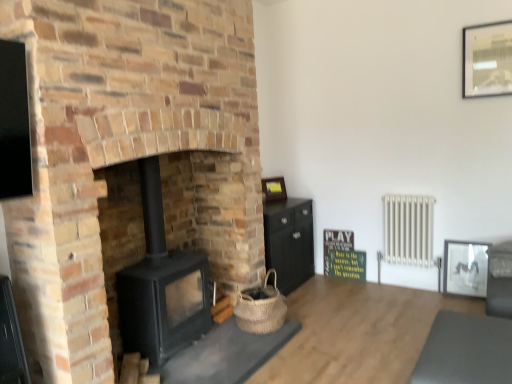
Question: Is green matte signboard at center bigger than black matte wood burning stove at center-left?

Choices:
 (A) yes
 (B) no

Answer: (B)

Question: Is black matte wood burning stove at center-left located within green matte signboard at center?

Choices:
 (A) yes
 (B) no

Answer: (B)

Question: Is green matte signboard at center oriented towards black matte wood burning stove at center-left?

Choices:
 (A) yes
 (B) no

Answer: (A)

Question: Does green matte signboard at center appear on the right side of black matte wood burning stove at center-left?

Choices:
 (A) no
 (B) yes

Answer: (B)

Question: Is the depth of green matte signboard at center greater than that of black matte wood burning stove at center-left?

Choices:
 (A) no
 (B) yes

Answer: (B)

Question: Based on their sizes in the image, would you say green matte signboard at center is bigger or smaller than matte black picture frame at right, the second picture frame when ordered from back to front?

Choices:
 (A) big
 (B) small

Answer: (B)

Question: Is point (330, 233) positioned closer to the camera than point (477, 259)?

Choices:
 (A) farther
 (B) closer

Answer: (A)

Question: From the image's perspective, is green matte signboard at center above or below matte black picture frame at right, the second picture frame positioned from the right?

Choices:
 (A) below
 (B) above

Answer: (A)

Question: Relative to matte black picture frame at right, placed as the second picture frame when sorted from front to back, is green matte signboard at center in front or behind?

Choices:
 (A) behind
 (B) front

Answer: (A)

Question: Is white metallic radiator at right in front of or behind matte gold picture frame at center, which is counted as the first picture frame, starting from the left, in the image?

Choices:
 (A) front
 (B) behind

Answer: (A)

Question: Do you think white metallic radiator at right is within matte gold picture frame at center, which appears as the third picture frame when viewed from the right, or outside of it?

Choices:
 (A) outside
 (B) inside

Answer: (A)

Question: Considering the positions of white metallic radiator at right and matte gold picture frame at center, the third picture frame from the front, in the image, is white metallic radiator at right wider or thinner than matte gold picture frame at center, the third picture frame from the front,?

Choices:
 (A) thin
 (B) wide

Answer: (B)

Question: In terms of size, does white metallic radiator at right appear bigger or smaller than matte gold picture frame at center, the third picture frame from the front?

Choices:
 (A) small
 (B) big

Answer: (B)

Question: Considering the positions of point (286, 196) and point (496, 56), is point (286, 196) closer or farther from the camera than point (496, 56)?

Choices:
 (A) farther
 (B) closer

Answer: (A)

Question: In terms of width, does matte gold picture frame at center, marked as the first picture frame in a back-to-front arrangement, look wider or thinner when compared to metallic silver picture frame at upper right, which ranks as the first picture frame in top-to-bottom order?

Choices:
 (A) thin
 (B) wide

Answer: (B)